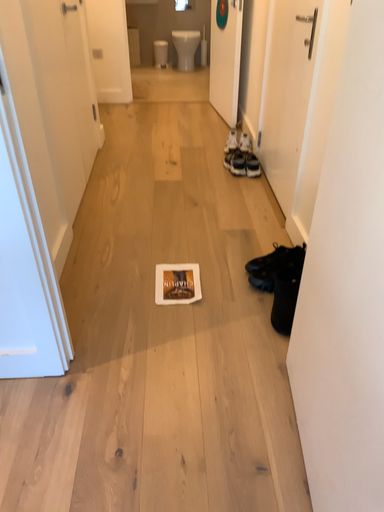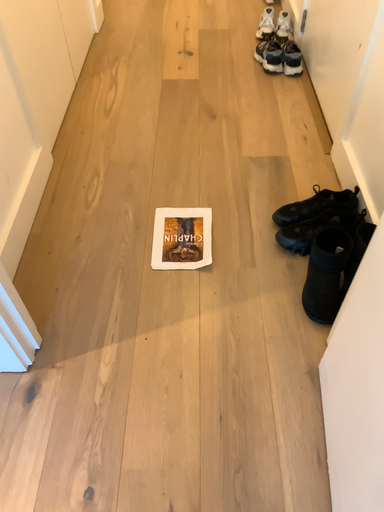
Question: Which way did the camera rotate in the video?

Choices:
 (A) rotated upward
 (B) rotated downward

Answer: (B)